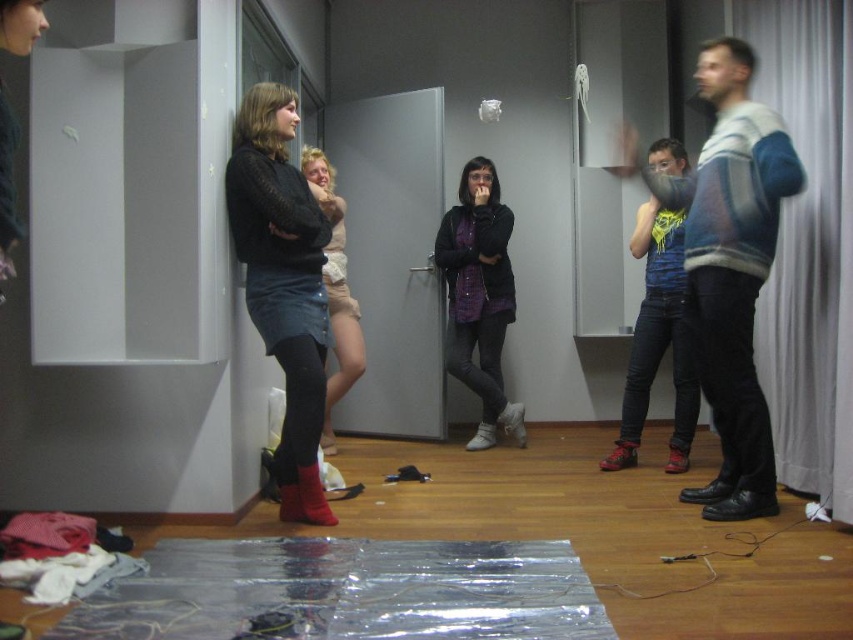
You are a GUI agent. You are given a task and a screenshot of the screen. Output one action in this format:
    pyautogui.click(x=<x>, y=<y>)
    Task: Click on the matte purple shirt at center
    
    Given the screenshot: What is the action you would take?
    pyautogui.click(x=477, y=282)

Is matte purple shirt at center smaller than red suede boot at lower center?

No, matte purple shirt at center is not smaller than red suede boot at lower center.

What do you see at coordinates (477, 282) in the screenshot? Image resolution: width=853 pixels, height=640 pixels. I see `matte purple shirt at center` at bounding box center [477, 282].

At what (x,y) coordinates should I click in order to perform the action: click on matte purple shirt at center. Please return your answer as a coordinate pair (x, y). Looking at the image, I should click on (477, 282).

Which is below, matte black sweater at center or matte purple shirt at center?

matte black sweater at center is below.

Is matte black sweater at center thinner than matte purple shirt at center?

Yes.

Consider the image. Who is more forward, (289, 412) or (451, 374)?

Point (289, 412)

At what (x,y) coordinates should I click in order to perform the action: click on matte black sweater at center. Please return your answer as a coordinate pair (x, y). This screenshot has height=640, width=853. Looking at the image, I should click on (283, 284).

Can you confirm if striped sweater at right is bigger than neon yellow mesh tank top at center?

Indeed, striped sweater at right has a larger size compared to neon yellow mesh tank top at center.

Is point (750, 396) positioned after point (625, 401)?

No, (750, 396) is in front of (625, 401).

Locate an element on the screen. This screenshot has width=853, height=640. striped sweater at right is located at coordinates (729, 268).